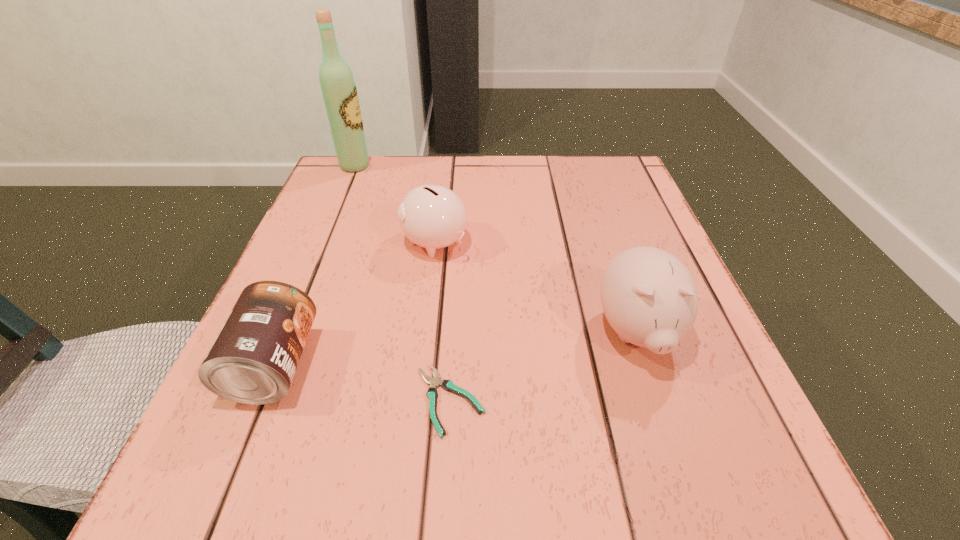
Where is `the tallest object`? The width and height of the screenshot is (960, 540). the tallest object is located at coordinates (338, 87).

I want to click on the farthest object, so click(x=338, y=87).

This screenshot has width=960, height=540. What are the coordinates of `the rightmost object` in the screenshot? It's located at point(649,297).

Find the location of a particular element. This screenshot has width=960, height=540. the right piggy bank is located at coordinates (649, 297).

At what (x,y) coordinates should I click in order to perform the action: click on the left piggy bank. Please return your answer as a coordinate pair (x, y). Image resolution: width=960 pixels, height=540 pixels. Looking at the image, I should click on (432, 216).

At what (x,y) coordinates should I click in order to perform the action: click on the second farthest object. Please return your answer as a coordinate pair (x, y). Looking at the image, I should click on (432, 216).

The image size is (960, 540). Find the location of `can`. can is located at coordinates click(x=253, y=360).

Identify the location of the shortest object. This screenshot has height=540, width=960. (448, 385).

Where is `vacant space located 0.230m on the front-facing side of the wine bottle`? vacant space located 0.230m on the front-facing side of the wine bottle is located at coordinates (460, 166).

You are a GUI agent. You are given a task and a screenshot of the screen. Output one action in this format:
    pyautogui.click(x=<x>, y=<y>)
    Task: Click on the vacant space located 0.100m at the snout of the rightmost object
    Image resolution: width=960 pixels, height=540 pixels.
    Given the screenshot: What is the action you would take?
    pyautogui.click(x=674, y=442)